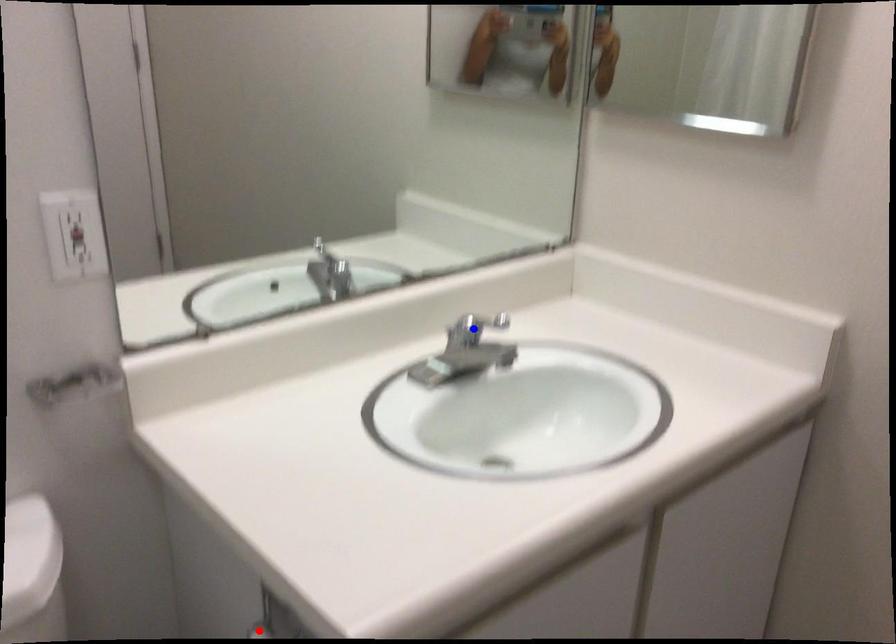
Question: Two points are marked on the image. Which point is closer to the camera?

Choices:
 (A) Blue point is closer.
 (B) Red point is closer.

Answer: (B)